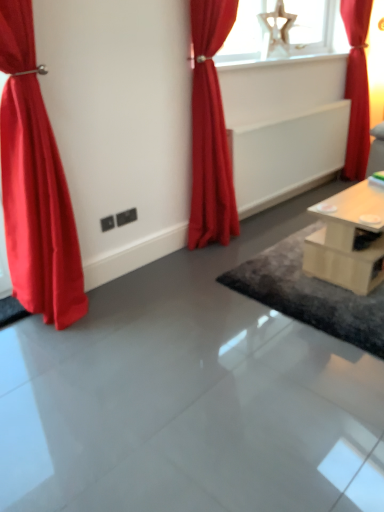
I want to click on empty space that is in between matte red curtain at left, marked as the first curtain in a left-to-right arrangement, and matte red curtain at center, positioned as the second curtain in left-to-right order, so click(154, 274).